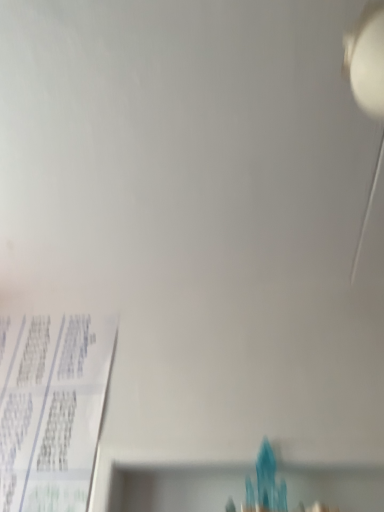
Identify the location of white paper at lower left. This screenshot has height=512, width=384. (53, 411).

This screenshot has height=512, width=384. What do you see at coordinates (53, 411) in the screenshot?
I see `white paper at lower left` at bounding box center [53, 411].

In order to face white paper at lower left, should I rotate leftwards or rightwards?

You should look left and rotate roughly 19.967 degrees.

Measure the distance between white paper at lower left and camera.

A distance of 3.37 feet exists between white paper at lower left and camera.

This screenshot has width=384, height=512. In order to click on white paper at lower left in this screenshot , I will do `click(53, 411)`.